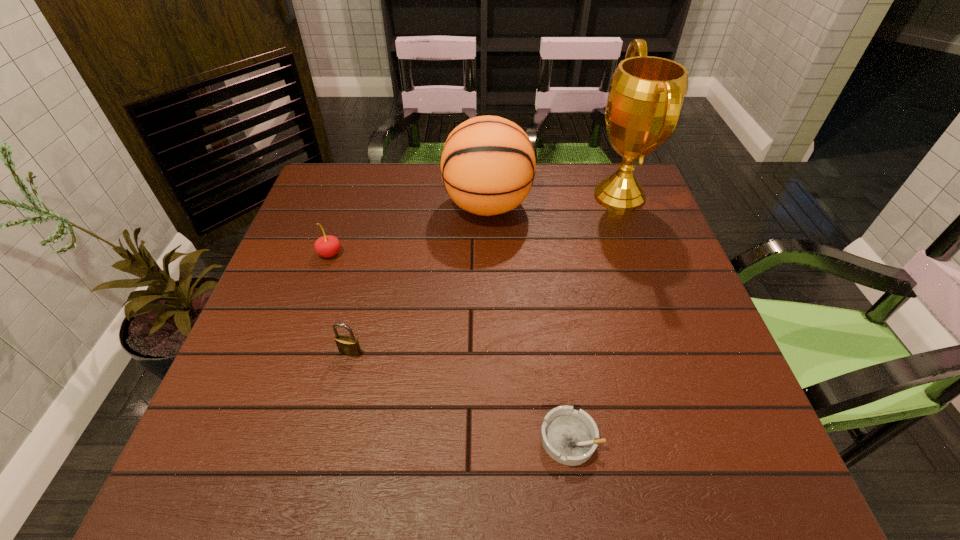
Find the location of `object that is at the right edge`. object that is at the right edge is located at coordinates (646, 94).

Image resolution: width=960 pixels, height=540 pixels. Find the location of `object that is at the far right corner`. object that is at the far right corner is located at coordinates [646, 94].

Where is `blank space at the far edge`? Image resolution: width=960 pixels, height=540 pixels. blank space at the far edge is located at coordinates (412, 164).

In the image, there is a desktop. Identify the location of free space at the near edge. (554, 475).

Find the location of a particular element. This screenshot has height=540, width=960. free space at the left edge is located at coordinates (328, 289).

At what (x,y) coordinates should I click in order to perform the action: click on vacant space at the right edge of the desktop. Please return your answer as a coordinate pair (x, y). Looking at the image, I should click on (723, 352).

In the image, there is a desktop. Where is `blank space at the far left corner`? This screenshot has height=540, width=960. blank space at the far left corner is located at coordinates (362, 164).

In the image, there is a desktop. Where is `blank space at the near left corner`? The height and width of the screenshot is (540, 960). blank space at the near left corner is located at coordinates (270, 460).

The height and width of the screenshot is (540, 960). In order to click on vacant area between the padlock and the leftmost object in this screenshot , I will do `click(341, 303)`.

I want to click on vacant area between the cherry and the fourth tallest object, so click(341, 303).